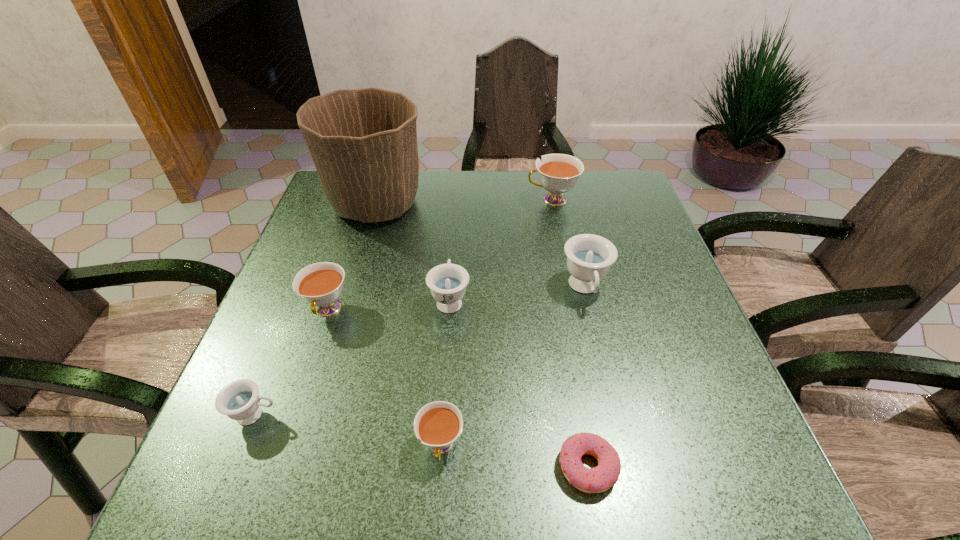
Choose which teacup is the second nearest neighbor to the rightmost blue teacup. Please provide its 2D coordinates. Your answer should be formatted as a tuple, i.e. [(x, y)], where the tuple contains the x and y coordinates of a point satisfying the conditions above.

[(558, 173)]

At what (x,y) coordinates should I click in order to perform the action: click on teacup that can be found as the closest to the second blue teacup from right to left. Please return your answer as a coordinate pair (x, y). This screenshot has height=540, width=960. Looking at the image, I should click on (320, 284).

Locate which white teacup ranks second in proximity to the second nearest white teacup. Please provide its 2D coordinates. Your answer should be formatted as a tuple, i.e. [(x, y)], where the tuple contains the x and y coordinates of a point satisfying the conditions above.

[(558, 173)]

What are the coordinates of `white teacup that stands as the closest to the second farthest white teacup` in the screenshot? It's located at (438, 424).

I want to click on blue teacup that is the closest to the leftmost blue teacup, so click(x=447, y=282).

Choose which blue teacup is the third nearest neighbor to the second smallest white teacup. Please provide its 2D coordinates. Your answer should be formatted as a tuple, i.e. [(x, y)], where the tuple contains the x and y coordinates of a point satisfying the conditions above.

[(589, 256)]

Identify the location of free space that satisfies the following two spatial constraints: 1. on the side of the smallest white teacup with the handle; 2. on the left side of the shortest object. This screenshot has height=540, width=960. (440, 467).

The image size is (960, 540). I want to click on free space that satisfies the following two spatial constraints: 1. on the side of the smallest white teacup with the handle; 2. on the left side of the doughnut, so click(x=440, y=467).

Where is `vacant area that satisfies the following two spatial constraints: 1. on the side of the nearest blue teacup with the handle; 2. on the left side of the pink doughnut`? vacant area that satisfies the following two spatial constraints: 1. on the side of the nearest blue teacup with the handle; 2. on the left side of the pink doughnut is located at coordinates (235, 467).

Locate an element on the screen. vacant position in the image that satisfies the following two spatial constraints: 1. on the side of the rightmost white teacup with the handle; 2. on the side of the second white teacup from right to left with the handle is located at coordinates 602,446.